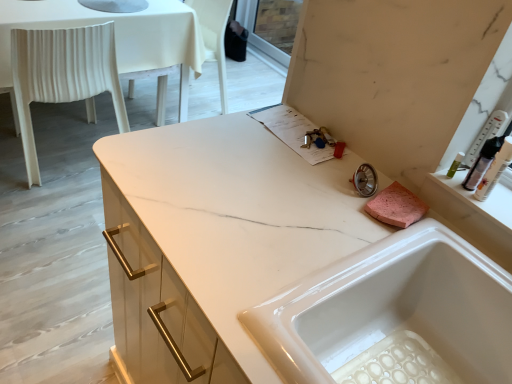
Question: Considering the relative positions of white glossy sink at center and white plastic chair at left in the image provided, is white glossy sink at center behind white plastic chair at left?

Choices:
 (A) yes
 (B) no

Answer: (B)

Question: Is white glossy sink at center facing towards white plastic chair at left?

Choices:
 (A) no
 (B) yes

Answer: (A)

Question: From a real-world perspective, is white glossy sink at center on top of white plastic chair at left?

Choices:
 (A) no
 (B) yes

Answer: (B)

Question: Is white glossy sink at center bigger than white plastic chair at left?

Choices:
 (A) yes
 (B) no

Answer: (B)

Question: Can you confirm if white glossy sink at center is smaller than white plastic chair at left?

Choices:
 (A) no
 (B) yes

Answer: (B)

Question: From the image's perspective, is white glossy sink at center located above or below white plastic chair at left?

Choices:
 (A) below
 (B) above

Answer: (A)

Question: From a real-world perspective, relative to white plastic chair at left, is white glossy sink at center vertically above or below?

Choices:
 (A) above
 (B) below

Answer: (A)

Question: Considering the positions of white glossy sink at center and white plastic chair at left in the image, is white glossy sink at center wider or thinner than white plastic chair at left?

Choices:
 (A) wide
 (B) thin

Answer: (B)

Question: Is white glossy sink at center inside or outside of white plastic chair at left?

Choices:
 (A) inside
 (B) outside

Answer: (B)

Question: From the image's perspective, relative to white glossy sink at center, is translucent plastic bottle at upper right above or below?

Choices:
 (A) above
 (B) below

Answer: (A)

Question: From a real-world perspective, is translucent plastic bottle at upper right above or below white glossy sink at center?

Choices:
 (A) above
 (B) below

Answer: (A)

Question: Is translucent plastic bottle at upper right taller or shorter than white glossy sink at center?

Choices:
 (A) short
 (B) tall

Answer: (A)

Question: Which is correct: translucent plastic bottle at upper right is inside white glossy sink at center, or outside of it?

Choices:
 (A) inside
 (B) outside

Answer: (B)

Question: In the image, is white glossy sink at center on the left side or the right side of translucent plastic bottle at upper right?

Choices:
 (A) right
 (B) left

Answer: (B)

Question: Looking at the image, does white glossy sink at center seem bigger or smaller compared to translucent plastic bottle at upper right?

Choices:
 (A) small
 (B) big

Answer: (B)